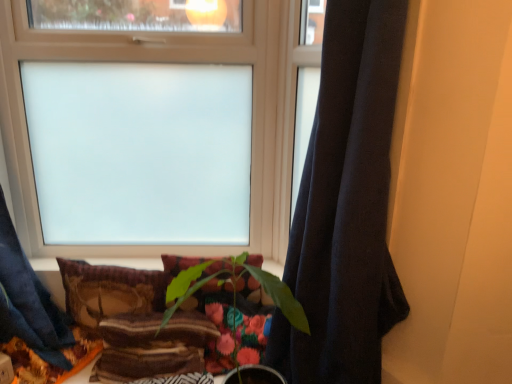
The width and height of the screenshot is (512, 384). What are the coordinates of `green matte plant at center` in the screenshot? It's located at (232, 291).

Find the location of a particular element. The width and height of the screenshot is (512, 384). frosted glass window at upper center is located at coordinates (169, 61).

Measure the distance between point [216,280] and camera.

Point [216,280] and camera are 1.56 meters apart.

What is the approximate width of velvet textured pillow at center, acting as the 1th pillow starting from the right?

The width of velvet textured pillow at center, acting as the 1th pillow starting from the right, is 3.59 inches.

The height and width of the screenshot is (384, 512). In order to click on green matte plant at center in this screenshot , I will do `click(232, 291)`.

Would you say green matte plant at center contains velvet-like brown pillow at lower center, acting as the second pillow starting from the right?

No, green matte plant at center does not contain velvet-like brown pillow at lower center, acting as the second pillow starting from the right.

From the image's perspective, between green matte plant at center and velvet-like brown pillow at lower center, acting as the second pillow starting from the right, which one is located above?

velvet-like brown pillow at lower center, acting as the second pillow starting from the right.

How much distance is there between green matte plant at center and velvet-like brown pillow at lower center, acting as the second pillow starting from the right?

green matte plant at center is 30.64 centimeters away from velvet-like brown pillow at lower center, acting as the second pillow starting from the right.

Can you confirm if green matte plant at center is smaller than velvet-like brown pillow at lower center, the 1th pillow viewed from the left?

No.

Would you say dark blue fabric curtain at right is a long distance from green matte plant at center?

dark blue fabric curtain at right is actually quite close to green matte plant at center.

What's the angular difference between dark blue fabric curtain at right and green matte plant at center's facing directions?

59.6 degrees separate the facing orientations of dark blue fabric curtain at right and green matte plant at center.

Considering the sizes of objects dark blue fabric curtain at right and green matte plant at center in the image provided, who is shorter, dark blue fabric curtain at right or green matte plant at center?

With less height is green matte plant at center.

Is dark blue fabric curtain at right completely or partially outside of green matte plant at center?

dark blue fabric curtain at right is positioned outside green matte plant at center.

Between frosted glass window at upper center and velvet textured pillow at center, acting as the 1th pillow starting from the right, which one has smaller width?

Thinner between the two is velvet textured pillow at center, acting as the 1th pillow starting from the right.

From a real-world perspective, is frosted glass window at upper center positioned under velvet textured pillow at center, which is the 2th pillow from left to right, based on gravity?

No, from a real-world perspective, frosted glass window at upper center is not below velvet textured pillow at center, which is the 2th pillow from left to right.

From the picture: Does frosted glass window at upper center have a larger size compared to velvet textured pillow at center, which is the 2th pillow from left to right?

Yes.

Would you consider velvet textured pillow at center, which is the 2th pillow from left to right, to be distant from dark blue fabric curtain at right?

Actually, velvet textured pillow at center, which is the 2th pillow from left to right, and dark blue fabric curtain at right are a little close together.

From a real-world perspective, is velvet textured pillow at center, acting as the 1th pillow starting from the right, over dark blue fabric curtain at right?

No.

Locate an element on the screen. The width and height of the screenshot is (512, 384). curtain located on the right of velvet textured pillow at center, acting as the 1th pillow starting from the right is located at coordinates (345, 206).

From the image's perspective, would you say frosted glass window at upper center is positioned over dark blue fabric curtain at right?

Yes, from the image's perspective, frosted glass window at upper center is above dark blue fabric curtain at right.

Which object is positioned more to the left, frosted glass window at upper center or dark blue fabric curtain at right?

frosted glass window at upper center is more to the left.

Is frosted glass window at upper center placed right next to dark blue fabric curtain at right?

No, frosted glass window at upper center is not next to dark blue fabric curtain at right.

In terms of width, does frosted glass window at upper center look wider or thinner when compared to dark blue fabric curtain at right?

Considering their sizes, frosted glass window at upper center looks slimmer than dark blue fabric curtain at right.

Which is less distant, (360, 194) or (186, 250)?

Point (360, 194) is positioned closer to the camera compared to point (186, 250).

How far apart are dark blue fabric curtain at right and frosted glass window at upper center?

They are 25.46 inches apart.

Is dark blue fabric curtain at right positioned with its back to frosted glass window at upper center?

No, frosted glass window at upper center is not at the back of dark blue fabric curtain at right.

Is dark blue fabric curtain at right positioned beyond the bounds of frosted glass window at upper center?

dark blue fabric curtain at right is positioned outside frosted glass window at upper center.

Based on the photo, how distant is dark blue fabric curtain at right from velvet textured pillow at center, acting as the 1th pillow starting from the right?

dark blue fabric curtain at right is 13.59 inches away from velvet textured pillow at center, acting as the 1th pillow starting from the right.

Between point (370, 219) and point (203, 309), which one is positioned behind?

The point (203, 309) is more distant.

From the image's perspective, which one is positioned higher, dark blue fabric curtain at right or velvet textured pillow at center, acting as the 1th pillow starting from the right?

dark blue fabric curtain at right.

In the image, is dark blue fabric curtain at right on the left side or the right side of velvet textured pillow at center, acting as the 1th pillow starting from the right?

In the image, dark blue fabric curtain at right appears on the right side of velvet textured pillow at center, acting as the 1th pillow starting from the right.

What are the coordinates of `the 2nd pillow located beneath the green matte plant at center (from a real-world perspective)` in the screenshot? It's located at (109, 291).

Where is `curtain in front of the green matte plant at center`? The width and height of the screenshot is (512, 384). curtain in front of the green matte plant at center is located at coordinates (345, 206).

Estimate the real-world distances between objects in this image. Which object is closer to velvet textured pillow at center, which is the 2th pillow from left to right, dark blue fabric curtain at right or frosted glass window at upper center?

dark blue fabric curtain at right.

Consider the image. Estimate the real-world distances between objects in this image. Which object is closer to green matte plant at center, velvet-like brown pillow at lower center, acting as the second pillow starting from the right, or velvet textured pillow at center, which is the 2th pillow from left to right?

Based on the image, velvet textured pillow at center, which is the 2th pillow from left to right, appears to be nearer to green matte plant at center.

Which object lies further to the anchor point velvet textured pillow at center, acting as the 1th pillow starting from the right, dark blue fabric curtain at right or velvet-like brown pillow at lower center, acting as the second pillow starting from the right?

dark blue fabric curtain at right.

Based on their spatial positions, is velvet textured pillow at center, acting as the 1th pillow starting from the right, or frosted glass window at upper center closer to velvet-like brown pillow at lower center, the 1th pillow viewed from the left?

velvet textured pillow at center, acting as the 1th pillow starting from the right, is positioned closer to the anchor velvet-like brown pillow at lower center, the 1th pillow viewed from the left.

Estimate the real-world distances between objects in this image. Which object is closer to velvet-like brown pillow at lower center, acting as the second pillow starting from the right, frosted glass window at upper center or dark blue fabric curtain at right?

Based on the image, frosted glass window at upper center appears to be nearer to velvet-like brown pillow at lower center, acting as the second pillow starting from the right.

From the image, which object appears to be nearer to green matte plant at center, velvet textured pillow at center, acting as the 1th pillow starting from the right, or frosted glass window at upper center?

Based on the image, velvet textured pillow at center, acting as the 1th pillow starting from the right, appears to be nearer to green matte plant at center.

Considering their positions, is velvet textured pillow at center, which is the 2th pillow from left to right, positioned closer to velvet-like brown pillow at lower center, the 1th pillow viewed from the left, than dark blue fabric curtain at right?

velvet textured pillow at center, which is the 2th pillow from left to right, is positioned closer to the anchor velvet-like brown pillow at lower center, the 1th pillow viewed from the left.

Looking at the image, which one is located closer to dark blue fabric curtain at right, velvet textured pillow at center, acting as the 1th pillow starting from the right, or velvet-like brown pillow at lower center, acting as the second pillow starting from the right?

velvet textured pillow at center, acting as the 1th pillow starting from the right.

Identify the location of pillow between dark blue fabric curtain at right and velvet textured pillow at center, acting as the 1th pillow starting from the right, in the front-back direction. Image resolution: width=512 pixels, height=384 pixels. pos(109,291).

Find the location of a particular element. pillow between frosted glass window at upper center and velvet-like brown pillow at lower center, the 1th pillow viewed from the left, vertically is located at coordinates (210, 294).

Identify the location of houseplant located between dark blue fabric curtain at right and frosted glass window at upper center in the depth direction. (232, 291).

Find the location of a particular element. window between dark blue fabric curtain at right and velvet textured pillow at center, which is the 2th pillow from left to right, along the z-axis is located at coordinates (169, 61).